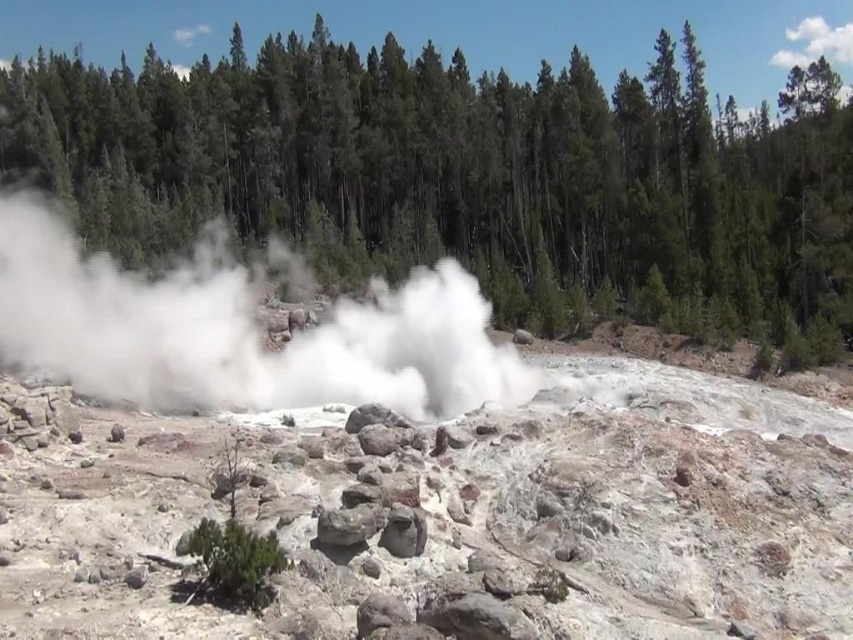
Can you confirm if green textured trees at center is thinner than white vapor at center?

No, green textured trees at center is not thinner than white vapor at center.

Which is behind, point (846, 202) or point (51, 244)?

Positioned behind is point (846, 202).

Between point (56, 160) and point (209, 372), which one is positioned in front?

Positioned in front is point (209, 372).

Where is `green textured trees at center`? Image resolution: width=853 pixels, height=640 pixels. green textured trees at center is located at coordinates (469, 179).